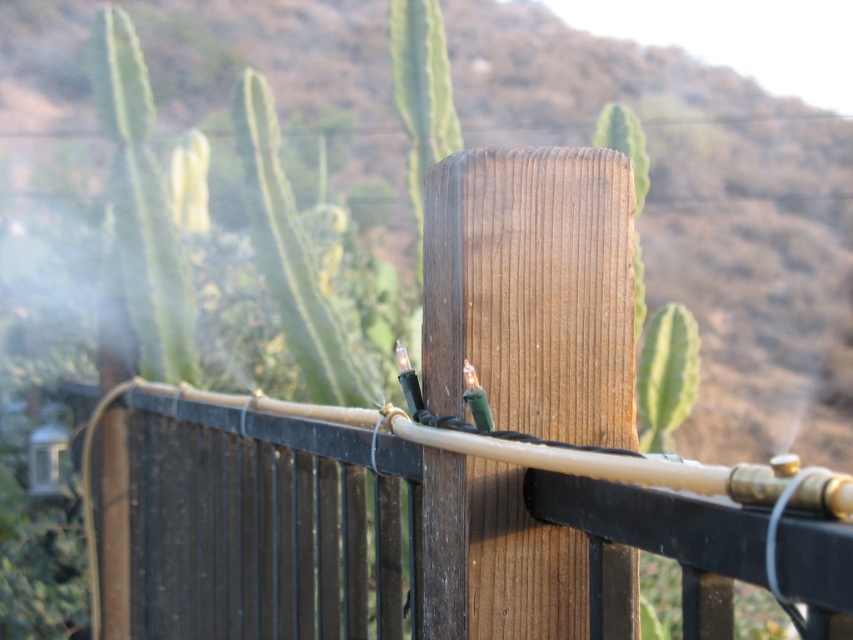
You are a delivery drone with a wingspan of 1.2 meters. You need to fly through the space between the brown wooden post at center and the brown wooden fence at center. Can you safely pass through this gap without touching either structure?

The gap between the brown wooden post at center and the brown wooden fence at center is 6.32 meters. Since your wingspan is 1.2 meters, which is significantly smaller than the gap, you can safely pass through without touching either structure.

You are standing in front of the brown wooden post at center and the brown wooden fence at center. Which object is closer to you?

The brown wooden post at center is closer to you than the brown wooden fence at center.

You are standing in a desert landscape with a wooden fence post in front of you. You want to place a small gift box exactly 8 meters away from the brown wooden post at center. Can you determine if you should move closer to or further away from the post to achieve this distance?

The brown wooden post at center is currently 8.47 meters away from you. To place the gift box 8 meters away from the post, you need to move closer to the post by 0.47 meters so that the distance between you and the post becomes 8 meters.